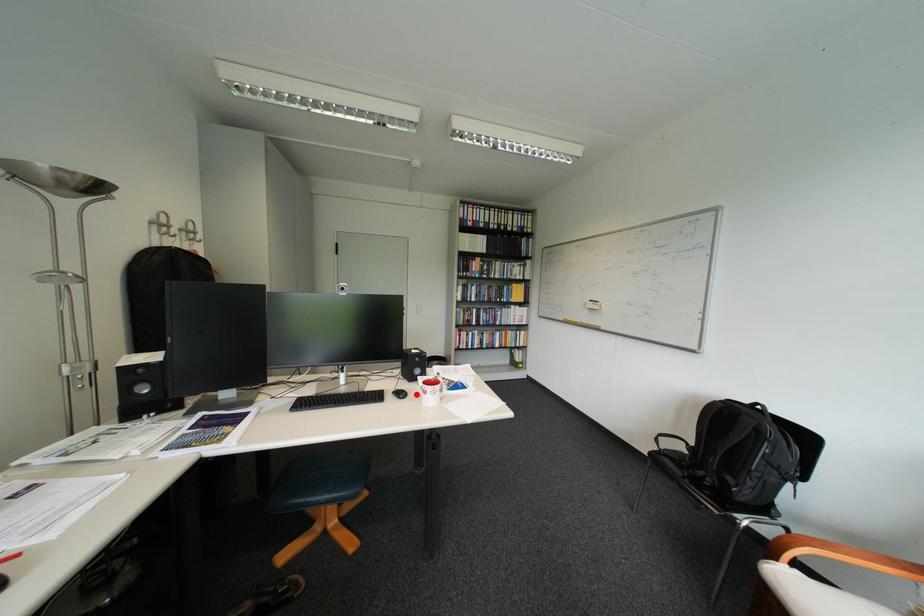
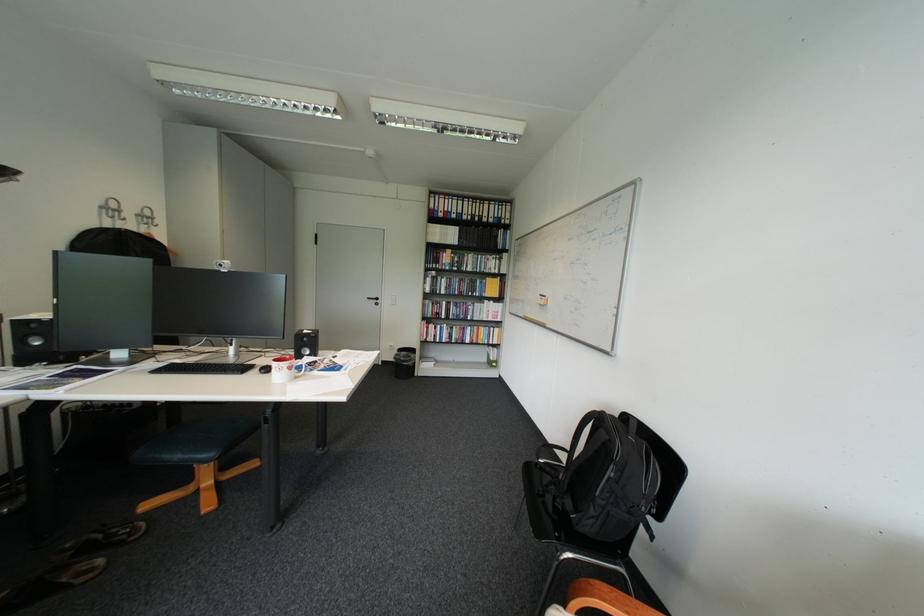
Locate, in the second image, the point that corresponds to the highlighted location in the first image.

(281, 370)